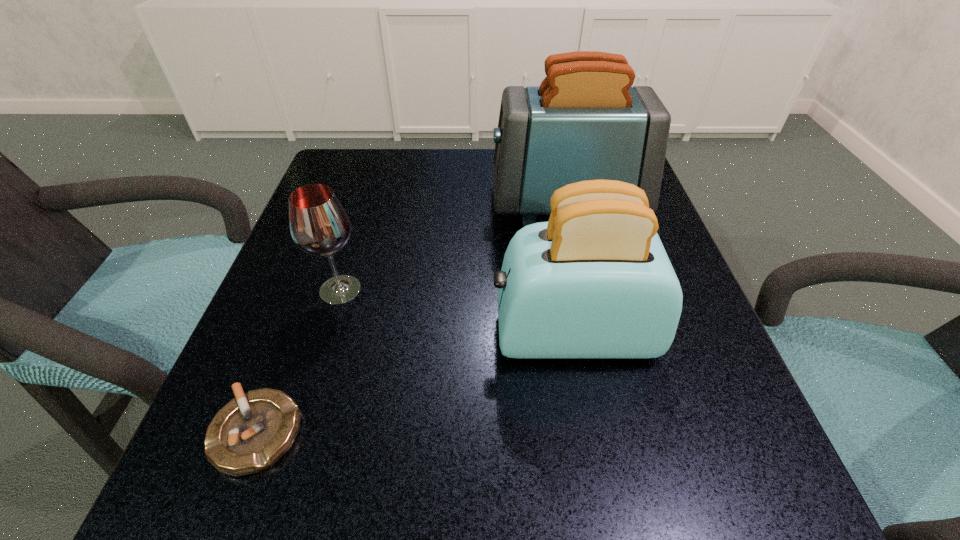
In order to click on vacant space at the near edge in this screenshot , I will do `click(379, 462)`.

Find the location of `free point at the left edge`. free point at the left edge is located at coordinates (233, 391).

In the image, there is a desktop. Where is `vacant space at the far left corner`? This screenshot has height=540, width=960. vacant space at the far left corner is located at coordinates (339, 180).

Where is `blank region between the ashtray and the wineglass`? The image size is (960, 540). blank region between the ashtray and the wineglass is located at coordinates (299, 361).

Identify the location of free area in between the nearer toaster and the shortest object. (415, 383).

Locate an element on the screen. unoccupied area between the farthest object and the second shortest object is located at coordinates (453, 247).

Identify the location of vacant point located between the wineglass and the shortest object. (299, 361).

This screenshot has height=540, width=960. Find the location of `free space between the nearer toaster and the wineglass`. free space between the nearer toaster and the wineglass is located at coordinates [x=456, y=312].

Identify the location of blank region between the nearer toaster and the wineglass. Image resolution: width=960 pixels, height=540 pixels. (456, 312).

Locate an element on the screen. This screenshot has height=540, width=960. unoccupied position between the second shortest object and the nearest object is located at coordinates (299, 361).